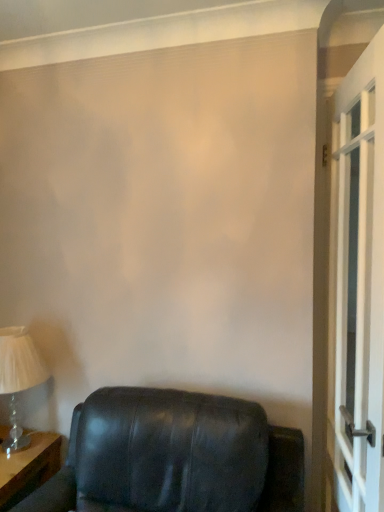
Question: From the image's perspective, is wooden table at lower left located above or below matte black leather chair at lower left?

Choices:
 (A) below
 (B) above

Answer: (A)

Question: In the image, is wooden table at lower left on the left side or the right side of matte black leather chair at lower left?

Choices:
 (A) right
 (B) left

Answer: (B)

Question: Based on their relative distances, which object is farther from the wooden table at lower left?

Choices:
 (A) white glass screen door at right
 (B) matte white lampshade at left
 (C) matte black leather chair at lower left

Answer: (A)

Question: Based on their relative distances, which object is farther from the matte white lampshade at left?

Choices:
 (A) wooden table at lower left
 (B) matte black leather chair at lower left
 (C) white glass screen door at right

Answer: (C)